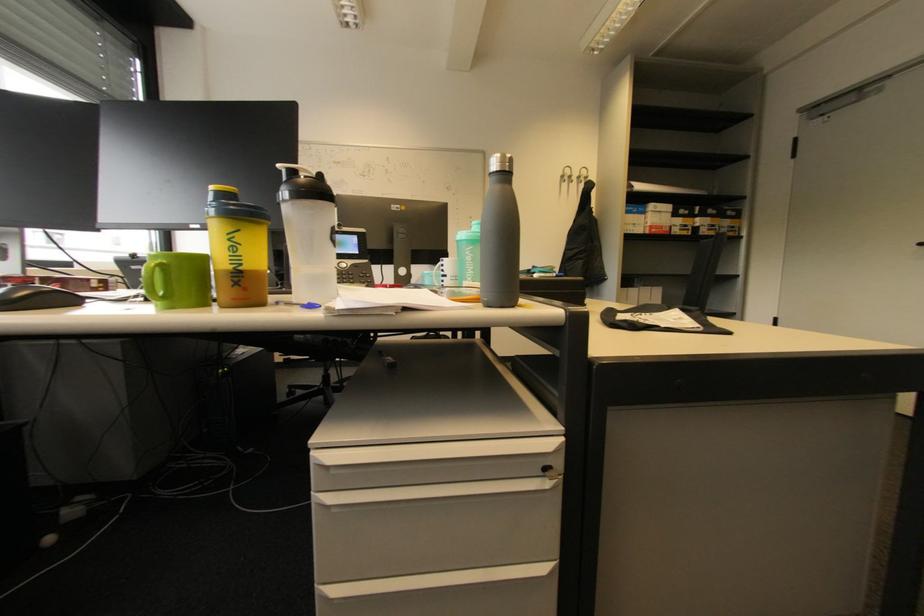
Where is `silver door handle`? The height and width of the screenshot is (616, 924). silver door handle is located at coordinates (918, 244).